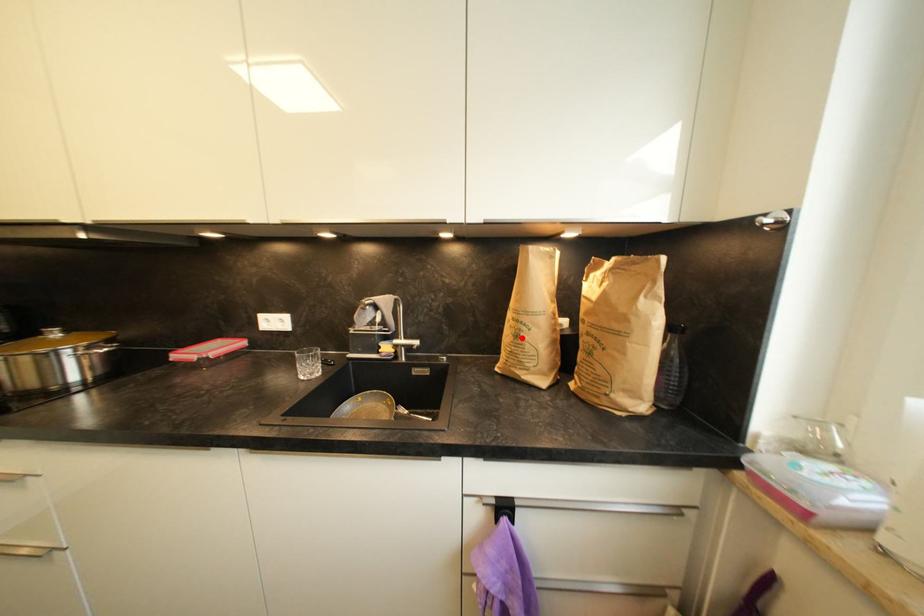
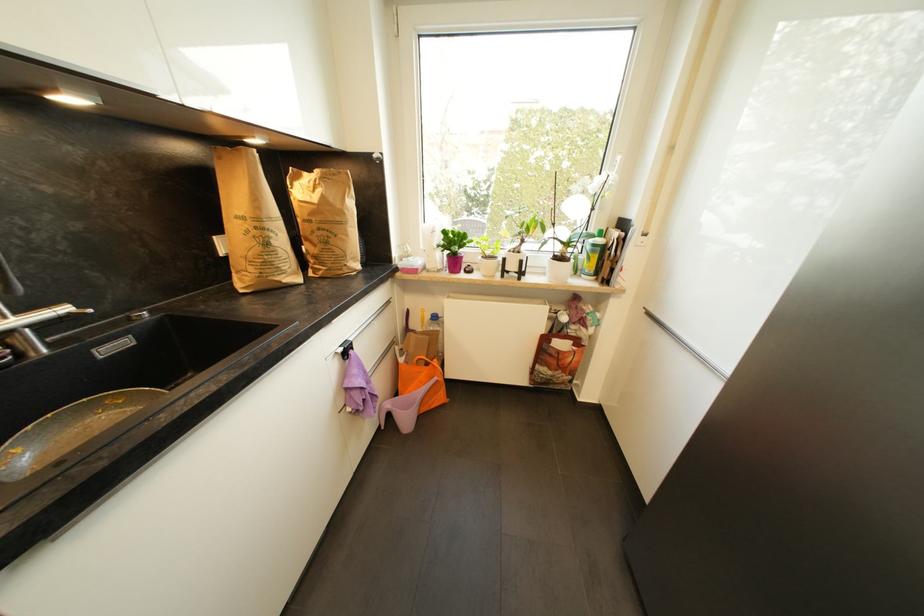
In the second image, find the point that corresponds to the highlighted location in the first image.

(272, 246)